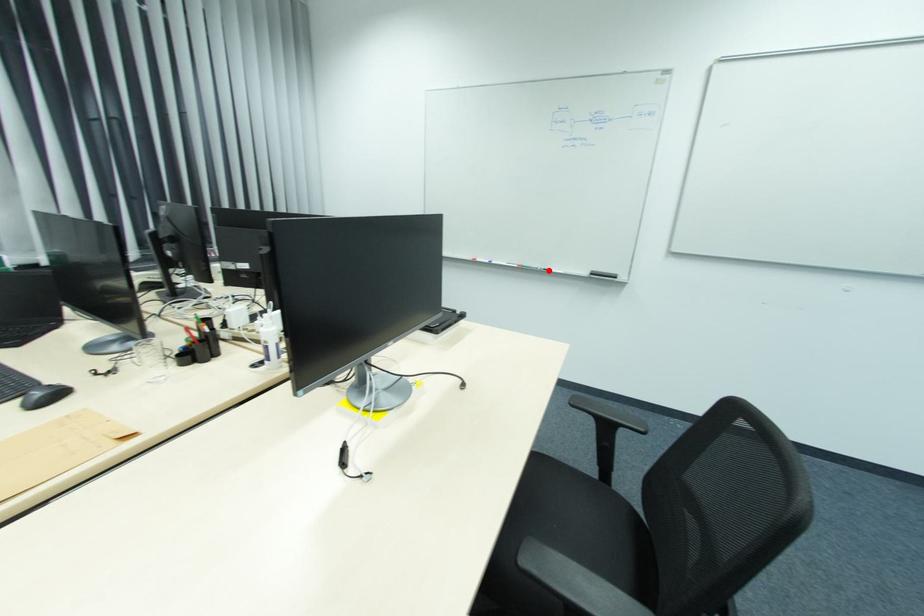
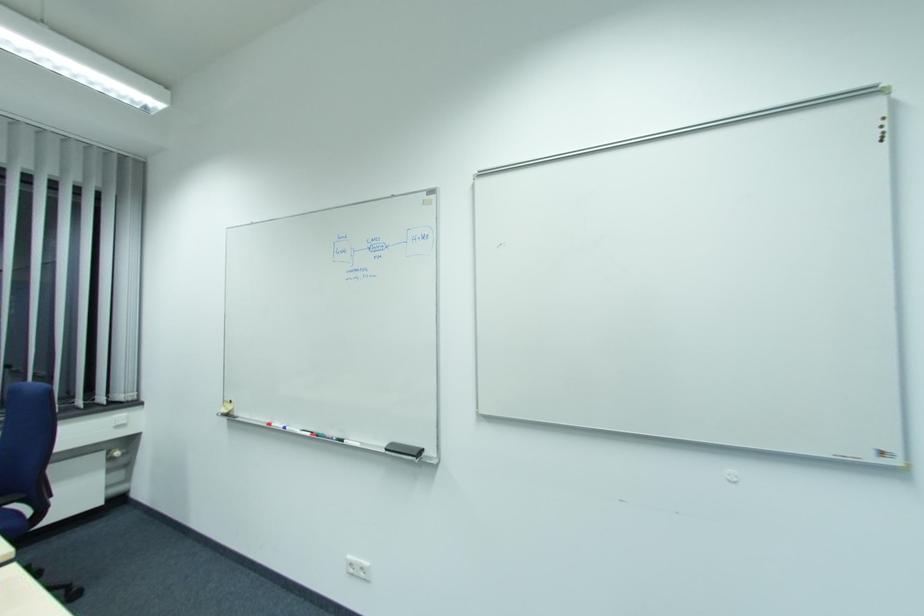
Find the pixel in the second image that matches the highlighted location in the first image.

(344, 440)